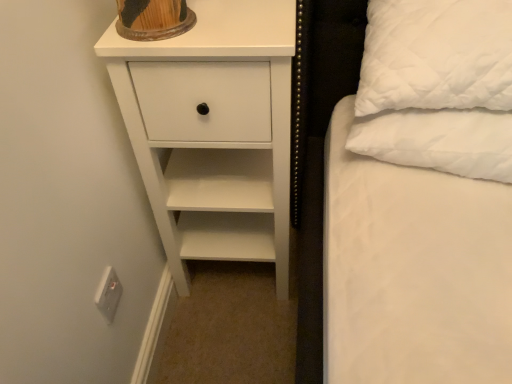
Question: Visually, is white quilted pillow at right positioned to the left or to the right of white matte chest of drawers at upper left?

Choices:
 (A) right
 (B) left

Answer: (A)

Question: From a real-world perspective, is white quilted pillow at right above or below white matte chest of drawers at upper left?

Choices:
 (A) above
 (B) below

Answer: (A)

Question: Estimate the real-world distances between objects in this image. Which object is farther from the white quilted pillow at right?

Choices:
 (A) white matte chest of drawers at upper left
 (B) white plastic electric outlet at lower left

Answer: (B)

Question: Which is farther from the white quilted pillow at right?

Choices:
 (A) white matte chest of drawers at upper left
 (B) white plastic electric outlet at lower left

Answer: (B)